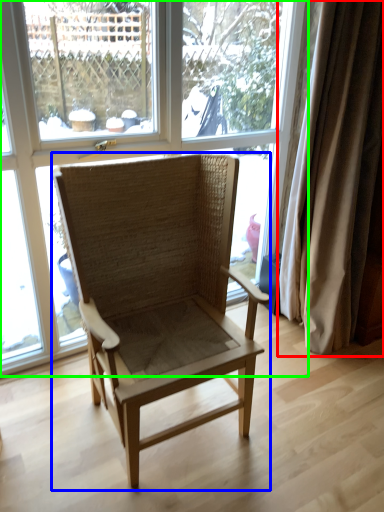
Question: Estimate the real-world distances between objects in this image. Which object is closer to curtain (highlighted by a red box), chair (highlighted by a blue box) or window (highlighted by a green box)?

Choices:
 (A) chair
 (B) window

Answer: (A)